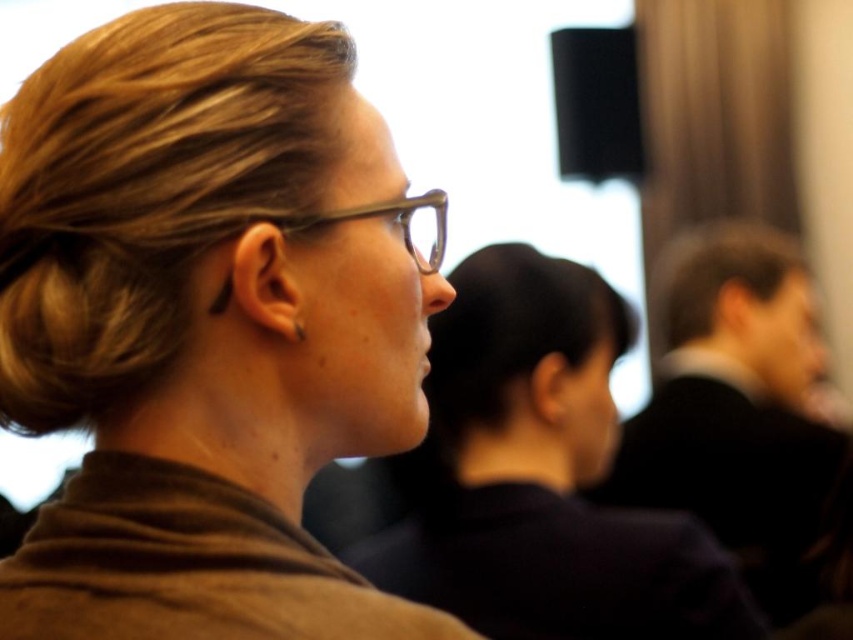
The width and height of the screenshot is (853, 640). Identify the location of transparent plastic glasses at center. (396, 220).

Is transparent plastic glasses at center shorter than clear plastic glasses at center?

No.

Who is more distant from viewer, (314, 225) or (440, 221)?

The point (440, 221) is more distant.

Locate an element on the screen. Image resolution: width=853 pixels, height=640 pixels. transparent plastic glasses at center is located at coordinates (396, 220).

Is point (56, 410) more distant than point (416, 253)?

That is False.

Is brown matte scarf at upper left shorter than transparent plastic glasses at center?

Incorrect, brown matte scarf at upper left's height does not fall short of transparent plastic glasses at center's.

Between point (218, 385) and point (438, 262), which one is positioned behind?

The point (438, 262) is behind.

At what (x,y) coordinates should I click in order to perform the action: click on brown matte scarf at upper left. Please return your answer as a coordinate pair (x, y). Looking at the image, I should click on (204, 326).

Looking at this image, between brown matte scarf at upper left and clear plastic glasses at center, which one is positioned higher?

clear plastic glasses at center is higher up.

This screenshot has height=640, width=853. Identify the location of brown matte scarf at upper left. (204, 326).

This screenshot has width=853, height=640. Describe the element at coordinates (204, 326) in the screenshot. I see `brown matte scarf at upper left` at that location.

This screenshot has width=853, height=640. I want to click on brown matte scarf at upper left, so click(204, 326).